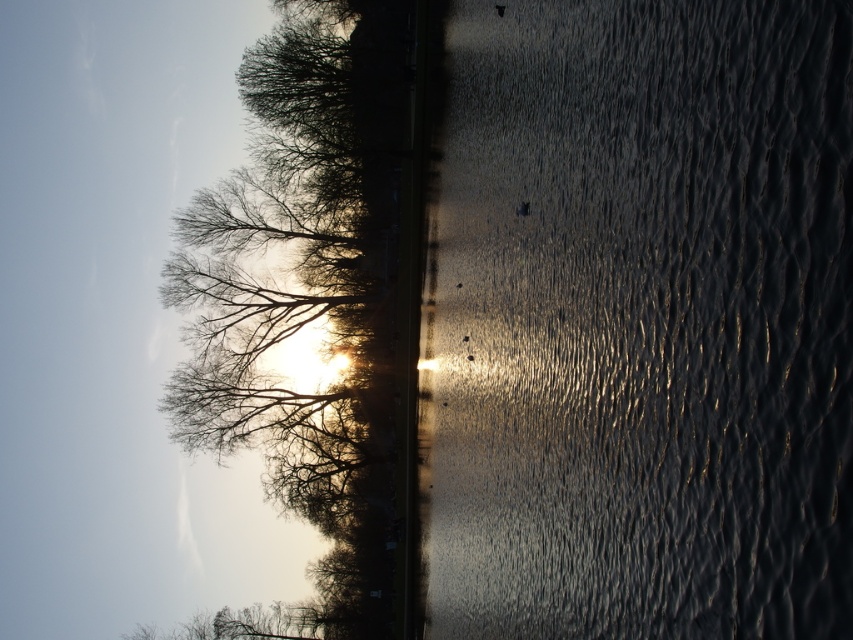
Who is positioned more to the left, silvery branches at upper left or bare branches at lower left?

bare branches at lower left

Does silvery branches at upper left have a greater height compared to bare branches at lower left?

Yes.

What do you see at coordinates (309, 291) in the screenshot?
I see `silvery branches at upper left` at bounding box center [309, 291].

Locate an element on the screen. The width and height of the screenshot is (853, 640). silvery branches at upper left is located at coordinates (309, 291).